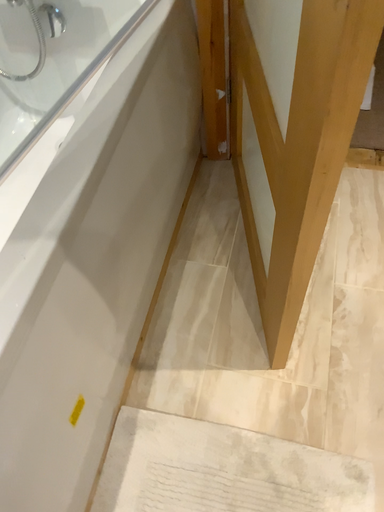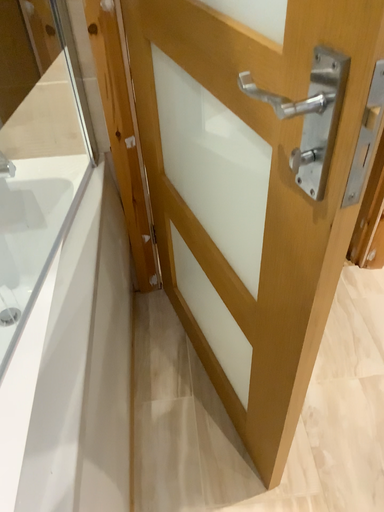
Question: How did the camera likely rotate when shooting the video?

Choices:
 (A) rotated right
 (B) rotated left

Answer: (A)